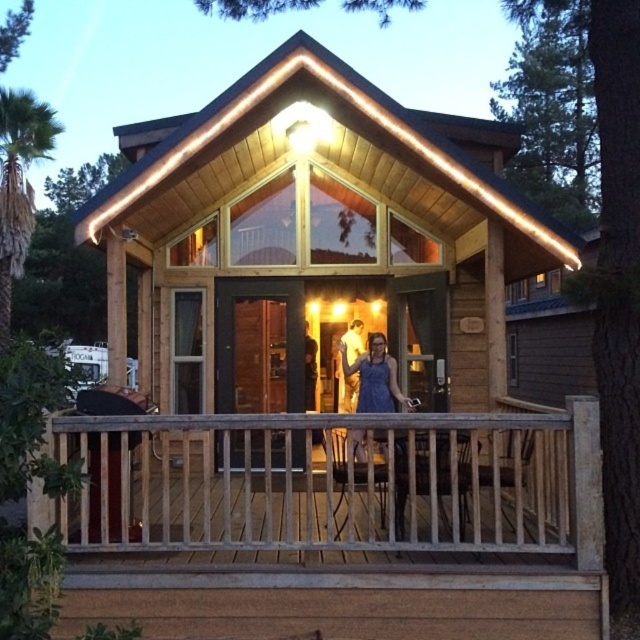
You are organizing a clothing display in a store and have two dresses in front of you. The first is a blue denim dress at center, and the second is a matte blue dress at center. If you need to place them side by side on a narrow shelf, which dress should you place first to ensure both can fit?

The blue denim dress at center is wider than the matte blue dress at center. To fit both on the narrow shelf, place the narrower matte blue dress at center first, leaving space for the wider blue denim dress at center.

You are standing at the entrance of the wooden cabin. Looking out, you notice a specific point marked at coordinates (339,483). What does this point indicate?

The point at coordinates (339,483) marks the weathered wood porch at center.